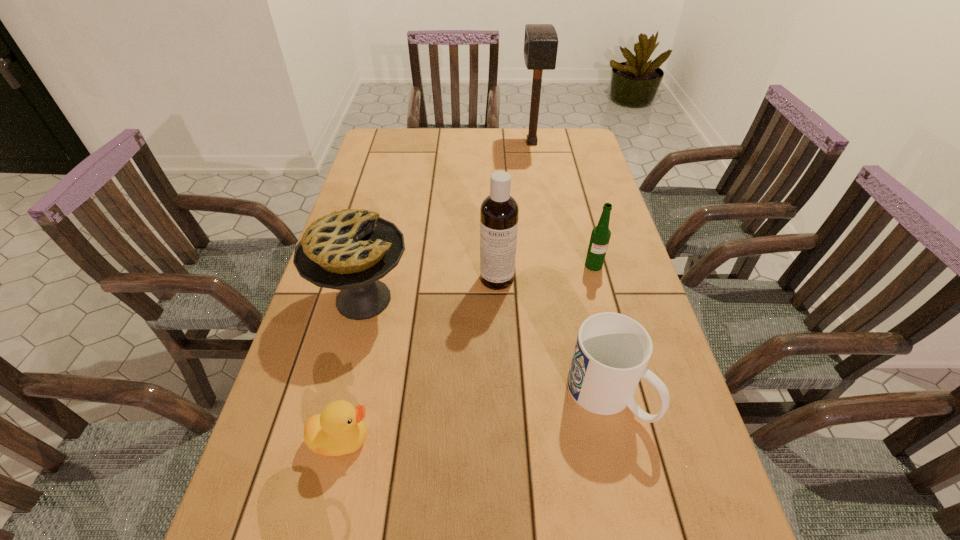
This screenshot has width=960, height=540. Find the location of `blank area in the image that satisfies the following two spatial constraints: 1. on the back side of the second shortest object; 2. on the cut side of the pie`. blank area in the image that satisfies the following two spatial constraints: 1. on the back side of the second shortest object; 2. on the cut side of the pie is located at coordinates (586, 299).

Find the location of `free spot that satisfies the following two spatial constraints: 1. on the label side of the fifth shortest object; 2. on the cut side of the pie`. free spot that satisfies the following two spatial constraints: 1. on the label side of the fifth shortest object; 2. on the cut side of the pie is located at coordinates (498, 299).

Image resolution: width=960 pixels, height=540 pixels. Find the location of `free location that satisfies the following two spatial constraints: 1. on the front side of the second shortest object; 2. at the beak of the shortest object`. free location that satisfies the following two spatial constraints: 1. on the front side of the second shortest object; 2. at the beak of the shortest object is located at coordinates (617, 439).

Locate an element on the screen. vacant area that satisfies the following two spatial constraints: 1. on the label of the beer bottle; 2. at the beak of the shortest object is located at coordinates (639, 439).

What are the coordinates of `vacant space that satisfies the following two spatial constraints: 1. on the back side of the mug; 2. on the cut side of the pie` in the screenshot? It's located at (586, 299).